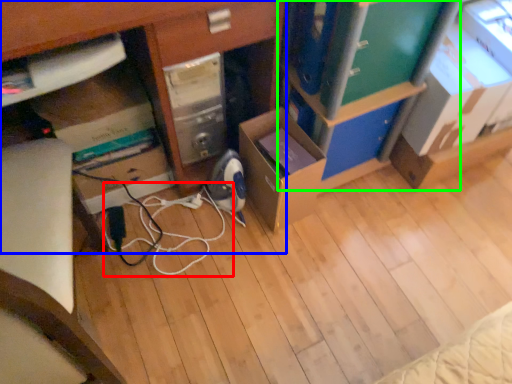
Question: Considering the real-world distances, which object is farthest from cable (highlighted by a red box)? desk (highlighted by a blue box) or bookshelf (highlighted by a green box)?

Choices:
 (A) desk
 (B) bookshelf

Answer: (B)